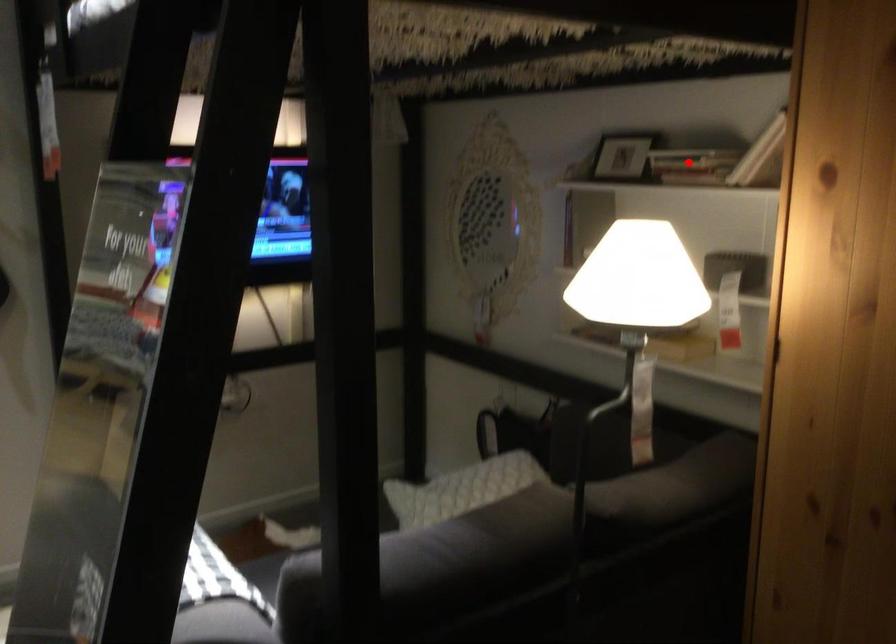
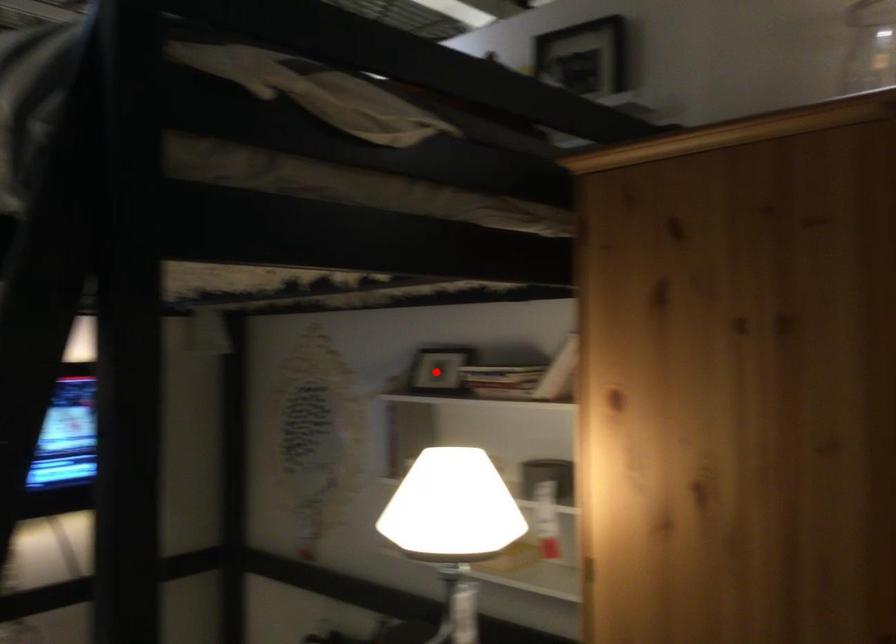
I am providing you with two images of the same scene from different viewpoints. A red point is marked on the first image and another point is marked on the second image. Does the point marked in image1 correspond to the same location as the one in image2?

No